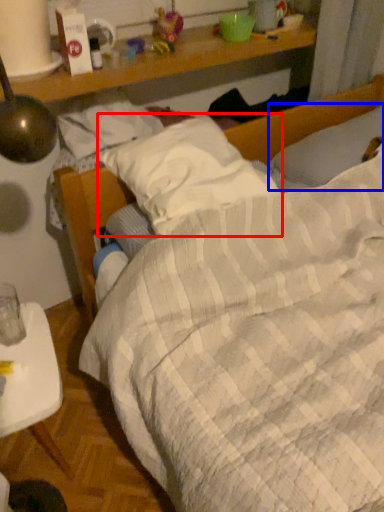
Question: Which object is closer to the camera taking this photo, pillow (highlighted by a red box) or pillow (highlighted by a blue box)?

Choices:
 (A) pillow
 (B) pillow

Answer: (A)